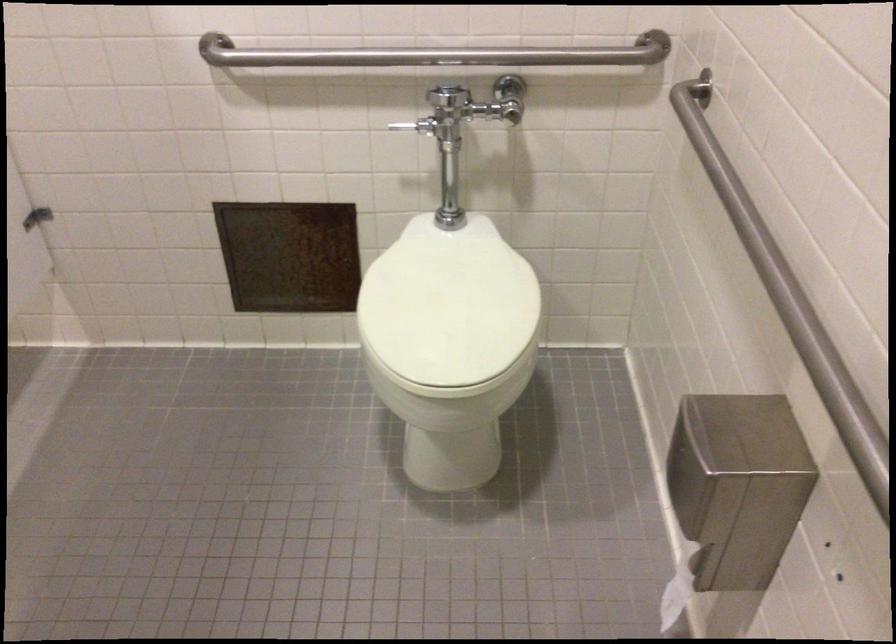
Find where to push the toilet flush handle. Please return your answer as a coordinate pair (x, y).

(401, 128)